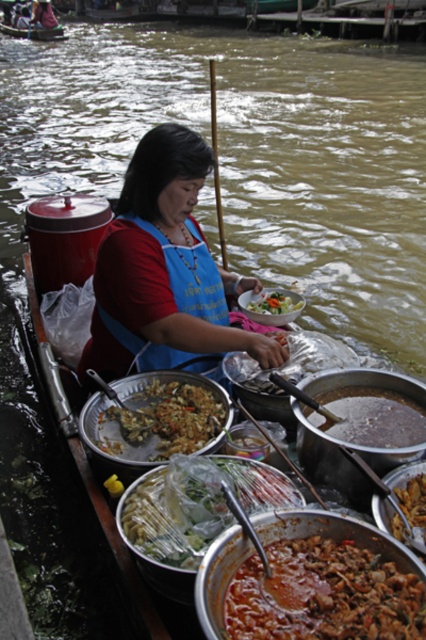
Consider the image. You are a customer at the floating market and want to ask the vendor if the translucent plastic bag at center can hold the contents of the shiny plastic bowl at center without spilling. Based on their sizes, what would you conclude?

The translucent plastic bag at center might be wider than the shiny plastic bowl at center, so it could potentially hold the contents without spilling, but there is uncertainty due to the word